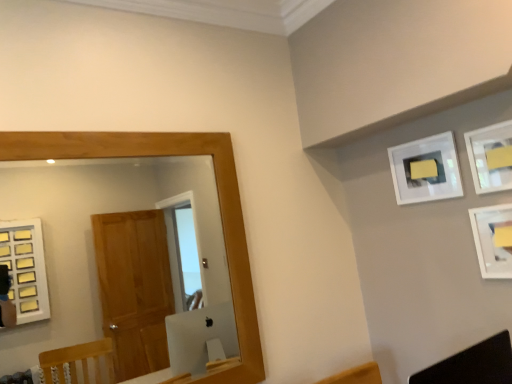
Describe the element at coordinates (92, 235) in the screenshot. This screenshot has width=512, height=384. I see `wooden-framed mirror at left` at that location.

This screenshot has width=512, height=384. I want to click on matte white picture frame at upper right, acting as the second picture frame starting from the front, so click(x=490, y=157).

This screenshot has height=384, width=512. Describe the element at coordinates (473, 364) in the screenshot. I see `black leather swivel chair at lower right` at that location.

In order to face white matte picture frame at upper right, acting as the 3th picture frame starting from the front, should I rotate leftwards or rightwards?

It's best to rotate right around 21.330 degrees.

What is the approximate width of white matte picture frame at upper right, the 3th picture frame positioned from the back?

The width of white matte picture frame at upper right, the 3th picture frame positioned from the back, is 1.92 inches.

Image resolution: width=512 pixels, height=384 pixels. I want to click on wooden-framed mirror at left, so click(x=92, y=235).

Is black leather swivel chair at lower right bigger than wooden-framed mirror at left?

No, black leather swivel chair at lower right is not bigger than wooden-framed mirror at left.

Does black leather swivel chair at lower right turn towards wooden-framed mirror at left?

No, black leather swivel chair at lower right does not turn towards wooden-framed mirror at left.

What are the coordinates of `the 3rd picture frame behind the wooden-framed mirror at left` in the screenshot? It's located at (426, 169).

Is point (55, 219) positioned behind point (414, 144)?

Yes.

Which is in front, wooden-framed mirror at left or white matte picture frame at upper right, acting as the 3th picture frame starting from the front?

wooden-framed mirror at left.

From the image's perspective, which one is positioned lower, wooden-framed mirror at left or white matte picture frame at upper right, placed as the 1th picture frame when sorted from back to front?

wooden-framed mirror at left.

From the image's perspective, would you say white matte picture frame at upper right, the 1th picture frame from the front, is shown under black leather swivel chair at lower right?

No.

Considering the positions of objects white matte picture frame at upper right, the 3th picture frame positioned from the back, and black leather swivel chair at lower right in the image provided, who is more to the right, white matte picture frame at upper right, the 3th picture frame positioned from the back, or black leather swivel chair at lower right?

white matte picture frame at upper right, the 3th picture frame positioned from the back.

Is black leather swivel chair at lower right at the back of white matte picture frame at upper right, the 1th picture frame from the front?

No.

Looking at this image, can you confirm if white matte picture frame at upper right, the 3th picture frame positioned from the back, is taller than black leather swivel chair at lower right?

Yes.

From a real-world perspective, is white matte picture frame at upper right, acting as the 3th picture frame starting from the front, physically located above or below black leather swivel chair at lower right?

Clearly, from a real-world perspective, white matte picture frame at upper right, acting as the 3th picture frame starting from the front, is above black leather swivel chair at lower right.

Is white matte picture frame at upper right, placed as the 1th picture frame when sorted from back to front, not close to black leather swivel chair at lower right?

That's not correct — white matte picture frame at upper right, placed as the 1th picture frame when sorted from back to front, is a little close to black leather swivel chair at lower right.

How many degrees apart are the facing directions of white matte picture frame at upper right, acting as the 3th picture frame starting from the front, and black leather swivel chair at lower right?

90 degrees.

From the image's perspective, is white matte picture frame at upper right, placed as the 1th picture frame when sorted from back to front, over black leather swivel chair at lower right?

Yes, from the image's perspective, white matte picture frame at upper right, placed as the 1th picture frame when sorted from back to front, is on top of black leather swivel chair at lower right.

Does white matte picture frame at upper right, the 1th picture frame from the front, touch wooden-framed mirror at left?

white matte picture frame at upper right, the 1th picture frame from the front, is not next to wooden-framed mirror at left, and they're not touching.

Considering the positions of points (479, 212) and (65, 274), is point (479, 212) farther from camera compared to point (65, 274)?

No, (479, 212) is in front of (65, 274).

Where is `the 3rd picture frame to the right of the wooden-framed mirror at left, counting from the anchor's position`? the 3rd picture frame to the right of the wooden-framed mirror at left, counting from the anchor's position is located at coordinates (493, 240).

In the scene shown: From the image's perspective, is white matte picture frame at upper right, the 3th picture frame positioned from the back, on wooden-framed mirror at left?

Correct, white matte picture frame at upper right, the 3th picture frame positioned from the back, appears higher than wooden-framed mirror at left in the image.

Find the location of a particular element. the 1st picture frame located above the white matte picture frame at upper right, the 3th picture frame positioned from the back (from a real-world perspective) is located at coordinates (490, 157).

From the image's perspective, is matte white picture frame at upper right, the 2th picture frame in the back-to-front sequence, under white matte picture frame at upper right, the 3th picture frame positioned from the back?

Actually, matte white picture frame at upper right, the 2th picture frame in the back-to-front sequence, appears above white matte picture frame at upper right, the 3th picture frame positioned from the back, in the image.

Is matte white picture frame at upper right, acting as the second picture frame starting from the front, wider than white matte picture frame at upper right, the 3th picture frame positioned from the back?

No.

Can you confirm if white matte picture frame at upper right, the 1th picture frame from the front, is smaller than matte white picture frame at upper right, acting as the second picture frame starting from the front?

No, white matte picture frame at upper right, the 1th picture frame from the front, is not smaller than matte white picture frame at upper right, acting as the second picture frame starting from the front.

Which is in front, point (481, 228) or point (505, 179)?

Positioned in front is point (505, 179).

Would you say white matte picture frame at upper right, the 1th picture frame from the front, contains matte white picture frame at upper right, the 2th picture frame in the back-to-front sequence?

That's incorrect, matte white picture frame at upper right, the 2th picture frame in the back-to-front sequence, is not inside white matte picture frame at upper right, the 1th picture frame from the front.

From their relative heights in the image, would you say white matte picture frame at upper right, the 1th picture frame from the front, is taller or shorter than matte white picture frame at upper right, acting as the second picture frame starting from the front?

white matte picture frame at upper right, the 1th picture frame from the front, is taller than matte white picture frame at upper right, acting as the second picture frame starting from the front.

Find the location of a particular element. swivel chair located below the wooden-framed mirror at left (from the image's perspective) is located at coordinates (473, 364).

From the image's perspective, count 2nd picture frames upward from the wooden-framed mirror at left and point to it. Please provide its 2D coordinates.

[(426, 169)]

Looking at the image, which one is located closer to matte white picture frame at upper right, the 2th picture frame in the back-to-front sequence, white matte picture frame at upper right, placed as the 1th picture frame when sorted from back to front, or wooden-framed mirror at left?

white matte picture frame at upper right, placed as the 1th picture frame when sorted from back to front, is positioned closer to the anchor matte white picture frame at upper right, the 2th picture frame in the back-to-front sequence.

Considering their positions, is matte white picture frame at upper right, acting as the second picture frame starting from the front, positioned further to black leather swivel chair at lower right than white matte picture frame at upper right, the 3th picture frame positioned from the back?

matte white picture frame at upper right, acting as the second picture frame starting from the front.

When comparing their distances from wooden-framed mirror at left, does white matte picture frame at upper right, the 3th picture frame positioned from the back, or matte white picture frame at upper right, acting as the second picture frame starting from the front, seem further?

matte white picture frame at upper right, acting as the second picture frame starting from the front, is positioned further to the anchor wooden-framed mirror at left.

Estimate the real-world distances between objects in this image. Which object is closer to white matte picture frame at upper right, placed as the 1th picture frame when sorted from back to front, matte white picture frame at upper right, the 2th picture frame in the back-to-front sequence, or wooden-framed mirror at left?

matte white picture frame at upper right, the 2th picture frame in the back-to-front sequence.

From the image, which object appears to be nearer to wooden-framed mirror at left, matte white picture frame at upper right, acting as the second picture frame starting from the front, or black leather swivel chair at lower right?

Among the two, black leather swivel chair at lower right is located nearer to wooden-framed mirror at left.

When comparing their distances from white matte picture frame at upper right, the 3th picture frame positioned from the back, does matte white picture frame at upper right, the 2th picture frame in the back-to-front sequence, or black leather swivel chair at lower right seem further?

Based on the image, black leather swivel chair at lower right appears to be further to white matte picture frame at upper right, the 3th picture frame positioned from the back.

When comparing their distances from matte white picture frame at upper right, acting as the second picture frame starting from the front, does white matte picture frame at upper right, acting as the 3th picture frame starting from the front, or white matte picture frame at upper right, the 1th picture frame from the front, seem further?

Based on the image, white matte picture frame at upper right, the 1th picture frame from the front, appears to be further to matte white picture frame at upper right, acting as the second picture frame starting from the front.

Looking at the image, which one is located closer to white matte picture frame at upper right, placed as the 1th picture frame when sorted from back to front, black leather swivel chair at lower right or matte white picture frame at upper right, the 2th picture frame in the back-to-front sequence?

The object closer to white matte picture frame at upper right, placed as the 1th picture frame when sorted from back to front, is matte white picture frame at upper right, the 2th picture frame in the back-to-front sequence.

The height and width of the screenshot is (384, 512). I want to click on swivel chair situated between wooden-framed mirror at left and white matte picture frame at upper right, placed as the 1th picture frame when sorted from back to front, from left to right, so click(x=473, y=364).

Where is `swivel chair situated between wooden-framed mirror at left and matte white picture frame at upper right, the 2th picture frame in the back-to-front sequence, from left to right`? This screenshot has width=512, height=384. swivel chair situated between wooden-framed mirror at left and matte white picture frame at upper right, the 2th picture frame in the back-to-front sequence, from left to right is located at coordinates (473, 364).

At what (x,y) coordinates should I click in order to perform the action: click on picture frame that lies between matte white picture frame at upper right, the 2th picture frame in the back-to-front sequence, and white matte picture frame at upper right, the 1th picture frame from the front, from top to bottom. Please return your answer as a coordinate pair (x, y). The width and height of the screenshot is (512, 384). Looking at the image, I should click on (426, 169).

I want to click on picture frame between white matte picture frame at upper right, placed as the 1th picture frame when sorted from back to front, and black leather swivel chair at lower right vertically, so click(x=493, y=240).